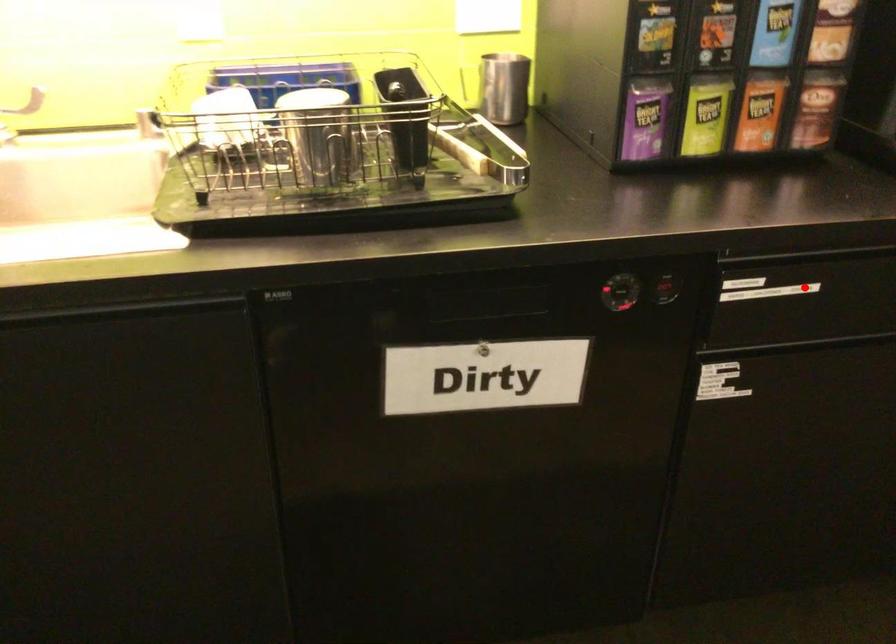
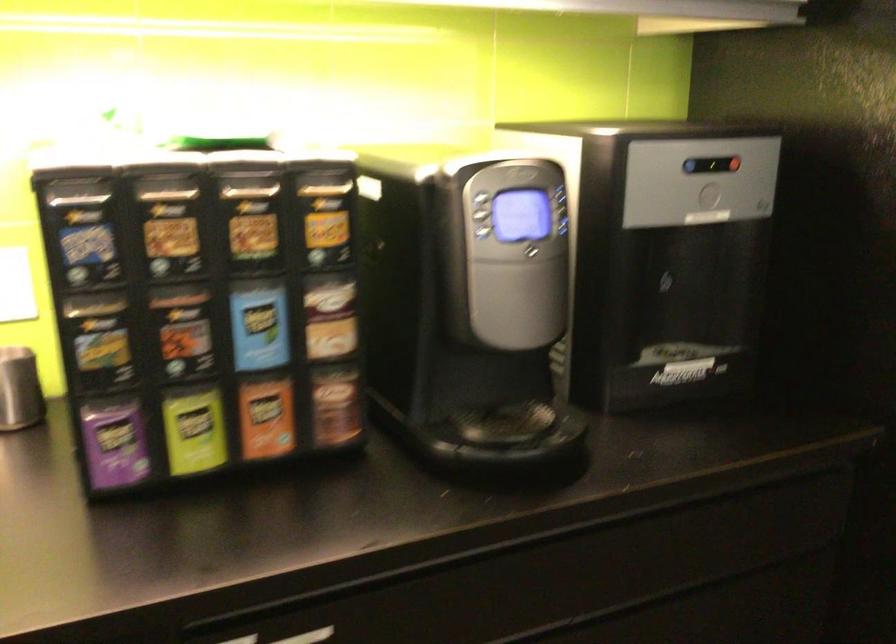
Locate, in the second image, the point that corresponds to the highlighted location in the first image.

(308, 636)